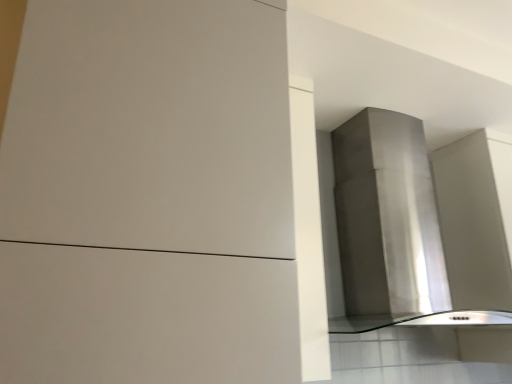
Based on the photo, what is the approximate width of matte white cabinet at center?

The width of matte white cabinet at center is 25.63 inches.

What do you see at coordinates (159, 198) in the screenshot?
I see `matte white cabinet at center` at bounding box center [159, 198].

This screenshot has height=384, width=512. What are the coordinates of `matte white cabinet at center` in the screenshot? It's located at (159, 198).

What are the coordinates of `stainless steel vent at upper right` in the screenshot? It's located at (390, 228).

What do you see at coordinates (390, 228) in the screenshot? I see `stainless steel vent at upper right` at bounding box center [390, 228].

In order to face stainless steel vent at upper right, should I rotate leftwards or rightwards?

You should look right and rotate roughly 18.790 degrees.

Where is `matte white cabinet at center`? matte white cabinet at center is located at coordinates (159, 198).

Between matte white cabinet at center and stainless steel vent at upper right, which one appears on the right side from the viewer's perspective?

From the viewer's perspective, stainless steel vent at upper right appears more on the right side.

Considering the positions of objects matte white cabinet at center and stainless steel vent at upper right in the image provided, who is behind, matte white cabinet at center or stainless steel vent at upper right?

Positioned behind is stainless steel vent at upper right.

Does point (66, 74) lie in front of point (441, 250)?

Yes, point (66, 74) is in front of point (441, 250).

From the image's perspective, which one is positioned higher, matte white cabinet at center or stainless steel vent at upper right?

matte white cabinet at center.

From a real-world perspective, between matte white cabinet at center and stainless steel vent at upper right, who is vertically lower?

matte white cabinet at center, from a real-world perspective.

Can you confirm if matte white cabinet at center is thinner than stainless steel vent at upper right?

No.

Consider the image. Does matte white cabinet at center have a greater height compared to stainless steel vent at upper right?

Yes, matte white cabinet at center is taller than stainless steel vent at upper right.

Which of these two, matte white cabinet at center or stainless steel vent at upper right, is smaller?

Smaller between the two is stainless steel vent at upper right.

Is matte white cabinet at center surrounding stainless steel vent at upper right?

Actually, stainless steel vent at upper right is outside matte white cabinet at center.

Does matte white cabinet at center touch stainless steel vent at upper right?

No, matte white cabinet at center is not beside stainless steel vent at upper right.

Could you tell me if matte white cabinet at center is turned towards stainless steel vent at upper right?

No, matte white cabinet at center is not turned towards stainless steel vent at upper right.

How many degrees apart are the facing directions of matte white cabinet at center and stainless steel vent at upper right?

There is a 0.382-degree angle between the facing directions of matte white cabinet at center and stainless steel vent at upper right.

The width and height of the screenshot is (512, 384). I want to click on cabinetry beneath the stainless steel vent at upper right (from a real-world perspective), so click(x=159, y=198).

In the scene shown: Between stainless steel vent at upper right and matte white cabinet at center, which one appears on the left side from the viewer's perspective?

Positioned to the left is matte white cabinet at center.

Which object is more forward, stainless steel vent at upper right or matte white cabinet at center?

Positioned in front is matte white cabinet at center.

Which point is more distant from viewer, (400, 281) or (56, 184)?

The point (400, 281) is farther from the camera.

From the image's perspective, is stainless steel vent at upper right above or below matte white cabinet at center?

stainless steel vent at upper right is situated lower than matte white cabinet at center in the image.

From a real-world perspective, is stainless steel vent at upper right positioned over matte white cabinet at center based on gravity?

Yes, from a real-world perspective, stainless steel vent at upper right is above matte white cabinet at center.

Does stainless steel vent at upper right have a lesser width compared to matte white cabinet at center?

Indeed, stainless steel vent at upper right has a lesser width compared to matte white cabinet at center.

Between stainless steel vent at upper right and matte white cabinet at center, which one has less height?

stainless steel vent at upper right is shorter.

Who is smaller, stainless steel vent at upper right or matte white cabinet at center?

With smaller size is stainless steel vent at upper right.

Is stainless steel vent at upper right spatially inside matte white cabinet at center, or outside of it?

stainless steel vent at upper right is not inside matte white cabinet at center, it's outside.

Is stainless steel vent at upper right far away from matte white cabinet at center?

stainless steel vent at upper right is actually quite close to matte white cabinet at center.

Could you tell me if stainless steel vent at upper right is turned towards matte white cabinet at center?

No, stainless steel vent at upper right is not turned towards matte white cabinet at center.

How many degrees apart are the facing directions of stainless steel vent at upper right and matte white cabinet at center?

There is a 0.382-degree angle between the facing directions of stainless steel vent at upper right and matte white cabinet at center.

Find the location of `cabinetry that is on the left side of stainless steel vent at upper right`. cabinetry that is on the left side of stainless steel vent at upper right is located at coordinates (159, 198).

Where is `cabinetry in front of the stainless steel vent at upper right`? cabinetry in front of the stainless steel vent at upper right is located at coordinates (159, 198).

Where is `cabinetry that appears on the left of stainless steel vent at upper right`? Image resolution: width=512 pixels, height=384 pixels. cabinetry that appears on the left of stainless steel vent at upper right is located at coordinates (159, 198).